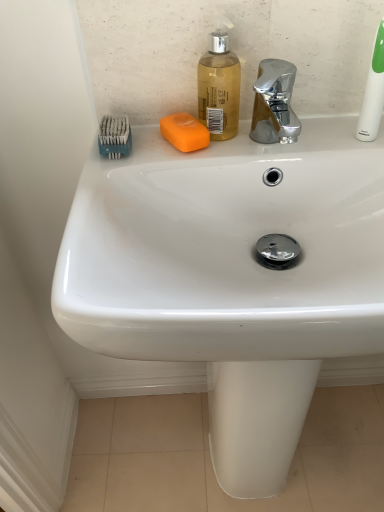
Question: Are translucent plastic soap dispenser at upper center and teal plastic toothbrush at upper left located far from each other?

Choices:
 (A) no
 (B) yes

Answer: (A)

Question: Can you confirm if translucent plastic soap dispenser at upper center is smaller than teal plastic toothbrush at upper left?

Choices:
 (A) no
 (B) yes

Answer: (A)

Question: Considering the relative positions of translucent plastic soap dispenser at upper center and teal plastic toothbrush at upper left in the image provided, is translucent plastic soap dispenser at upper center behind teal plastic toothbrush at upper left?

Choices:
 (A) no
 (B) yes

Answer: (A)

Question: Is translucent plastic soap dispenser at upper center bigger than teal plastic toothbrush at upper left?

Choices:
 (A) yes
 (B) no

Answer: (A)

Question: Can you confirm if translucent plastic soap dispenser at upper center is positioned to the left of teal plastic toothbrush at upper left?

Choices:
 (A) yes
 (B) no

Answer: (B)

Question: From the image's perspective, would you say translucent plastic soap dispenser at upper center is positioned over teal plastic toothbrush at upper left?

Choices:
 (A) yes
 (B) no

Answer: (A)

Question: Is white plastic toothbrush at upper right completely or partially inside translucent plastic soap dispenser at upper center?

Choices:
 (A) no
 (B) yes

Answer: (A)

Question: Is translucent plastic soap dispenser at upper center turned away from white plastic toothbrush at upper right?

Choices:
 (A) yes
 (B) no

Answer: (B)

Question: Considering the relative sizes of translucent plastic soap dispenser at upper center and white plastic toothbrush at upper right in the image provided, is translucent plastic soap dispenser at upper center thinner than white plastic toothbrush at upper right?

Choices:
 (A) no
 (B) yes

Answer: (A)

Question: From the image's perspective, is translucent plastic soap dispenser at upper center on white plastic toothbrush at upper right?

Choices:
 (A) yes
 (B) no

Answer: (B)

Question: From the image's perspective, is translucent plastic soap dispenser at upper center beneath white plastic toothbrush at upper right?

Choices:
 (A) yes
 (B) no

Answer: (A)

Question: Considering the relative positions of translucent plastic soap dispenser at upper center and white plastic toothbrush at upper right in the image provided, is translucent plastic soap dispenser at upper center to the right of white plastic toothbrush at upper right from the viewer's perspective?

Choices:
 (A) yes
 (B) no

Answer: (B)

Question: Are white plastic toothbrush at upper right and teal plastic toothbrush at upper left far apart?

Choices:
 (A) no
 (B) yes

Answer: (A)